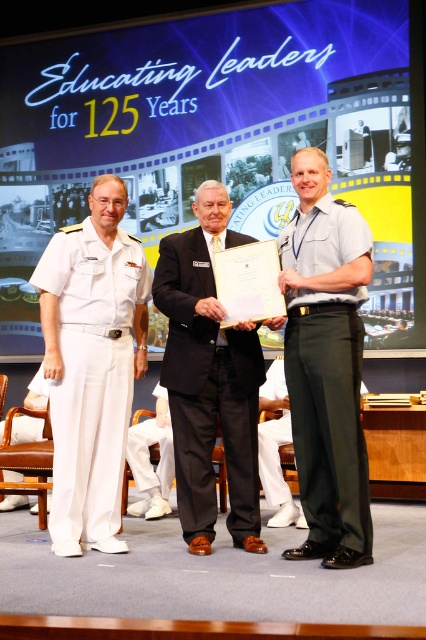
You are a photographer at the event and need to ensure both the green cotton pants at center and white cotton pants at lower center are visible in the photo. Which pair of pants should you focus on to ensure they are both in frame?

The green cotton pants at center has a larger size compared to white cotton pants at lower center, so focusing on the larger green cotton pants at center will help ensure both are visible in the frame.

You are standing at the back of the stage and want to hand a microphone to the person closest to you. Which point would you aim for, point (x=294, y=240) or point (x=203, y=358)?

Point (x=294, y=240) is closer to the viewer, so you should aim for that point.

You are an event photographer at the ceremony. You need to capture a closeup shot of the black wool suit at center and the white cotton pants at lower center. Which one should you zoom in on first to ensure it fits in the frame?

The black wool suit at center has a larger size compared to the white cotton pants at lower center, so you should zoom in on the black wool suit at center first to ensure it fits in the frame before adjusting for the smaller white cotton pants at lower center.